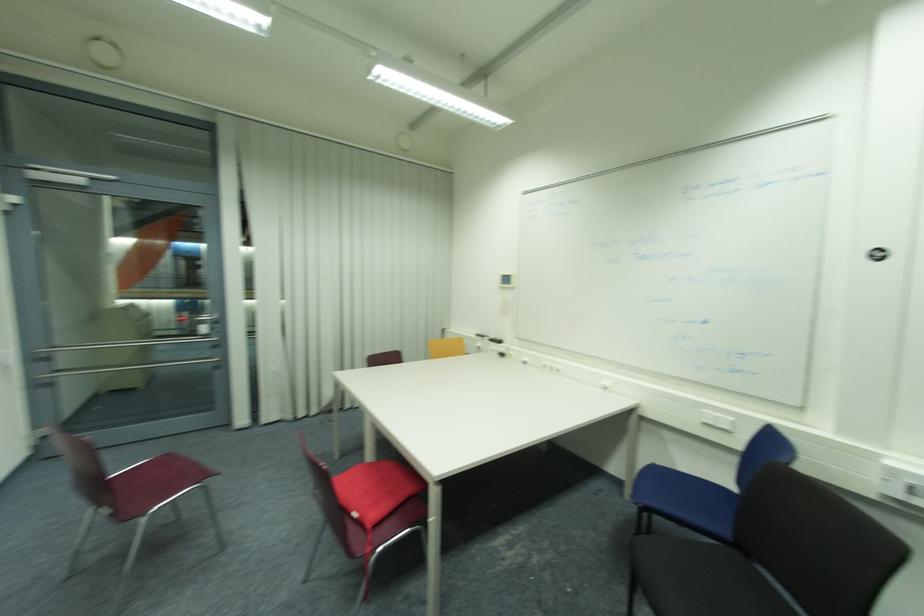
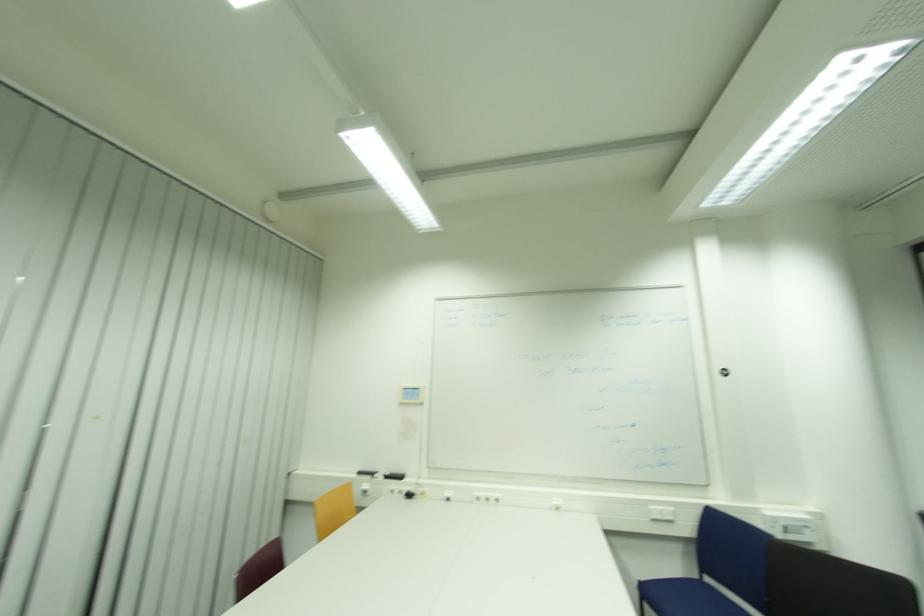
The point at (660, 464) is marked in the first image. Where is the corresponding point in the second image?

(648, 581)